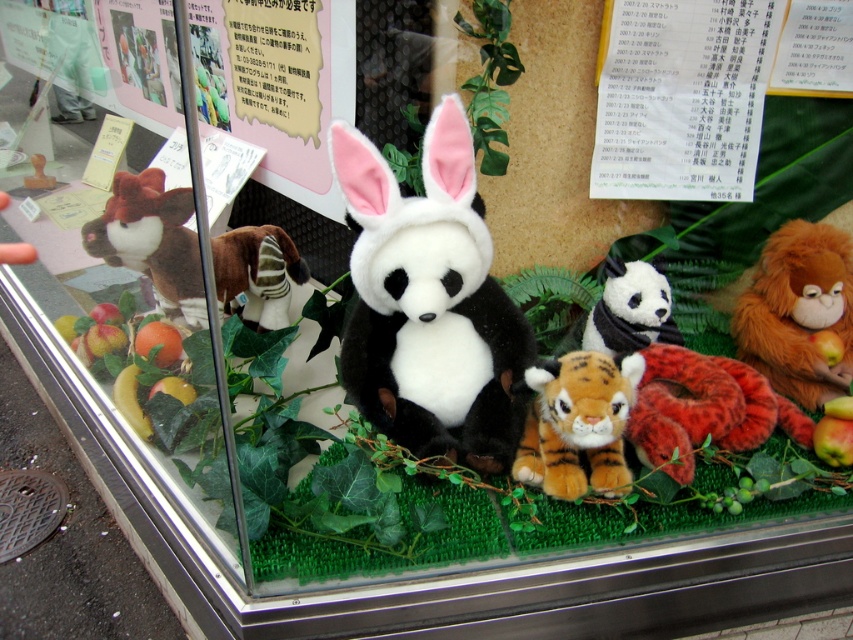
You are setting up a display in a zoo gift shop and need to place the velvet orange tiger at center and the orange plush tiger at center on a shelf. The shelf has a width of 10 inches. Can both items be placed side by side without overlapping?

The distance between the velvet orange tiger at center and the orange plush tiger at center is 6.45 inches. Since the shelf is 10 inches wide, there is enough space to place both items side by side without overlapping.

You are standing in front of the display case and want to find the orange plush monkey at right. According to the coordinates provided, where exactly is it positioned?

The orange plush monkey at right is located at point (x=798, y=310), which means it is positioned near the bottom right corner of the display case.